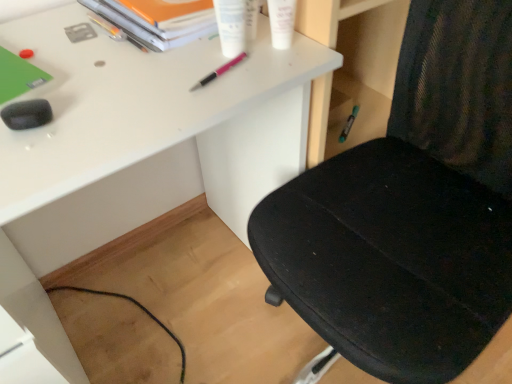
You are a GUI agent. You are given a task and a screenshot of the screen. Output one action in this format:
    pyautogui.click(x=<x>, y=<y>)
    Task: Click on the vacant space to the left of metallic silver pen at upper left, the second stationery viewed from the left
    This screenshot has height=384, width=512.
    Given the screenshot: What is the action you would take?
    pyautogui.click(x=40, y=32)